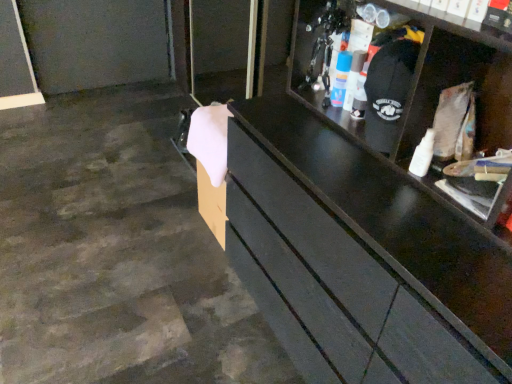
Question: In the image, is white glossy spray can at upper center, the first toiletry viewed from the left, positioned in front of or behind matte plastic spray can at upper right, positioned as the 1th toiletry in right-to-left order?

Choices:
 (A) front
 (B) behind

Answer: (B)

Question: Is white glossy spray can at upper center, the second toiletry in the right-to-left sequence, wider or thinner than matte plastic spray can at upper right, arranged as the second toiletry when viewed from the left?

Choices:
 (A) thin
 (B) wide

Answer: (A)

Question: From a real-world perspective, is white glossy spray can at upper center, the second toiletry in the right-to-left sequence, positioned above or below matte plastic spray can at upper right, positioned as the 1th toiletry in right-to-left order?

Choices:
 (A) above
 (B) below

Answer: (B)

Question: From their relative heights in the image, would you say matte plastic spray can at upper right, positioned as the 1th toiletry in right-to-left order, is taller or shorter than white glossy spray can at upper center, the first toiletry viewed from the left?

Choices:
 (A) short
 (B) tall

Answer: (B)

Question: In the image, is matte plastic spray can at upper right, positioned as the 1th toiletry in right-to-left order, positioned in front of or behind white glossy spray can at upper center, the first toiletry viewed from the left?

Choices:
 (A) front
 (B) behind

Answer: (A)

Question: Visually, is matte plastic spray can at upper right, positioned as the 1th toiletry in right-to-left order, positioned to the left or to the right of white glossy spray can at upper center, the second toiletry in the right-to-left sequence?

Choices:
 (A) left
 (B) right

Answer: (B)

Question: Considering the positions of point (355, 77) and point (339, 64), is point (355, 77) closer or farther from the camera than point (339, 64)?

Choices:
 (A) farther
 (B) closer

Answer: (B)